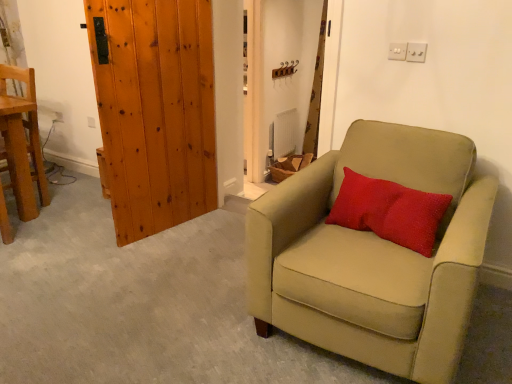
Question: Is red textured pillow at center smaller than matte brown curtain at upper center?

Choices:
 (A) yes
 (B) no

Answer: (A)

Question: From the image's perspective, is red textured pillow at center over matte brown curtain at upper center?

Choices:
 (A) yes
 (B) no

Answer: (B)

Question: From the image's perspective, is red textured pillow at center beneath matte brown curtain at upper center?

Choices:
 (A) yes
 (B) no

Answer: (A)

Question: Does red textured pillow at center have a greater width compared to matte brown curtain at upper center?

Choices:
 (A) yes
 (B) no

Answer: (B)

Question: Considering the relative sizes of red textured pillow at center and matte brown curtain at upper center in the image provided, is red textured pillow at center bigger than matte brown curtain at upper center?

Choices:
 (A) yes
 (B) no

Answer: (B)

Question: Considering the positions of point (308, 119) and point (31, 160), is point (308, 119) closer or farther from the camera than point (31, 160)?

Choices:
 (A) closer
 (B) farther

Answer: (B)

Question: From the image's perspective, relative to wooden chair at left, the second chair when ordered from front to back, is matte brown curtain at upper center above or below?

Choices:
 (A) above
 (B) below

Answer: (A)

Question: Considering the positions of matte brown curtain at upper center and wooden chair at left, which ranks as the first chair in left-to-right order, in the image, is matte brown curtain at upper center bigger or smaller than wooden chair at left, which ranks as the first chair in left-to-right order,?

Choices:
 (A) big
 (B) small

Answer: (B)

Question: Is matte brown curtain at upper center situated inside wooden chair at left, the second chair when ordered from front to back, or outside?

Choices:
 (A) outside
 (B) inside

Answer: (A)

Question: Do you think wooden chair at left, which ranks as the first chair in left-to-right order, is within matte brown curtain at upper center, or outside of it?

Choices:
 (A) outside
 (B) inside

Answer: (A)

Question: Does point (25, 77) appear closer or farther from the camera than point (325, 34)?

Choices:
 (A) closer
 (B) farther

Answer: (B)

Question: Considering the positions of wooden chair at left, the first chair viewed from the back, and matte brown curtain at upper center in the image, is wooden chair at left, the first chair viewed from the back, taller or shorter than matte brown curtain at upper center?

Choices:
 (A) tall
 (B) short

Answer: (B)

Question: From the image's perspective, is wooden chair at left, which is the second chair in right-to-left order, above or below matte brown curtain at upper center?

Choices:
 (A) below
 (B) above

Answer: (A)

Question: Considering the relative positions of suede beige armchair at right, which is the first chair in right-to-left order, and matte brown curtain at upper center in the image provided, is suede beige armchair at right, which is the first chair in right-to-left order, to the left or to the right of matte brown curtain at upper center?

Choices:
 (A) right
 (B) left

Answer: (B)

Question: Is point (438, 372) positioned closer to the camera than point (309, 125)?

Choices:
 (A) farther
 (B) closer

Answer: (B)